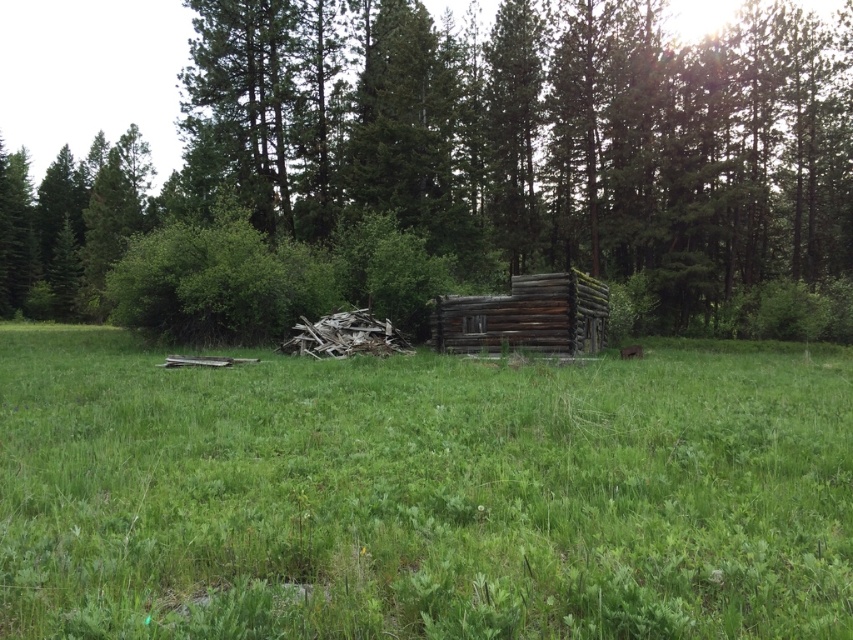
Question: Can you confirm if green grassy at center is positioned below weathered wood log cabin at center?

Choices:
 (A) yes
 (B) no

Answer: (A)

Question: Which object is farther from the camera taking this photo?

Choices:
 (A) green grassy at center
 (B) weathered wood log cabin at center
 (C) weathered wood cabin at center

Answer: (C)

Question: Which of the following is the farthest from the observer?

Choices:
 (A) weathered wood cabin at center
 (B) weathered wood log cabin at center
 (C) green grassy at center

Answer: (A)

Question: Does weathered wood cabin at center appear on the left side of weathered wood log cabin at center?

Choices:
 (A) no
 (B) yes

Answer: (B)

Question: Which point is closer to the camera?

Choices:
 (A) (764, 32)
 (B) (758, 499)

Answer: (B)

Question: Is weathered wood cabin at center positioned in front of weathered wood log cabin at center?

Choices:
 (A) yes
 (B) no

Answer: (B)